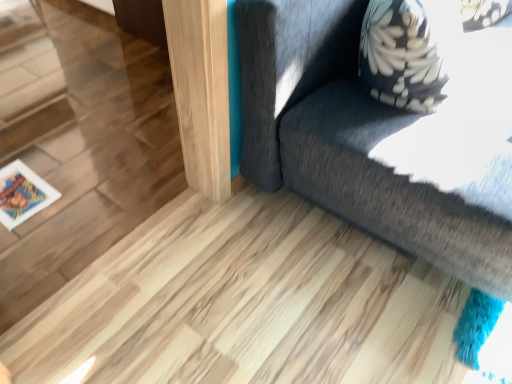
Question: From the image's perspective, would you say dark gray fabric couch at upper right is shown under wooden frame at lower left?

Choices:
 (A) no
 (B) yes

Answer: (A)

Question: From a real-world perspective, is dark gray fabric couch at upper right physically above wooden frame at lower left?

Choices:
 (A) no
 (B) yes

Answer: (B)

Question: Is dark gray fabric couch at upper right next to wooden frame at lower left?

Choices:
 (A) yes
 (B) no

Answer: (B)

Question: Is dark gray fabric couch at upper right smaller than wooden frame at lower left?

Choices:
 (A) yes
 (B) no

Answer: (B)

Question: Can you confirm if dark gray fabric couch at upper right is thinner than wooden frame at lower left?

Choices:
 (A) no
 (B) yes

Answer: (A)

Question: From a real-world perspective, is dark gray fabric couch at upper right below wooden frame at lower left?

Choices:
 (A) no
 (B) yes

Answer: (A)

Question: Would you say dark gray fabric couch at upper right is part of wooden frame at lower left's contents?

Choices:
 (A) yes
 (B) no

Answer: (B)

Question: Considering the relative sizes of wooden frame at lower left and dark gray fabric couch at upper right in the image provided, is wooden frame at lower left thinner than dark gray fabric couch at upper right?

Choices:
 (A) yes
 (B) no

Answer: (A)

Question: Would you consider wooden frame at lower left to be distant from dark gray fabric couch at upper right?

Choices:
 (A) yes
 (B) no

Answer: (A)

Question: From the image's perspective, would you say wooden frame at lower left is shown under dark gray fabric couch at upper right?

Choices:
 (A) no
 (B) yes

Answer: (B)

Question: Is the position of wooden frame at lower left more distant than that of dark gray fabric couch at upper right?

Choices:
 (A) yes
 (B) no

Answer: (A)

Question: Can you see wooden frame at lower left touching dark gray fabric couch at upper right?

Choices:
 (A) no
 (B) yes

Answer: (A)

Question: From their relative heights in the image, would you say dark gray fabric couch at upper right is taller or shorter than wooden frame at lower left?

Choices:
 (A) short
 (B) tall

Answer: (B)